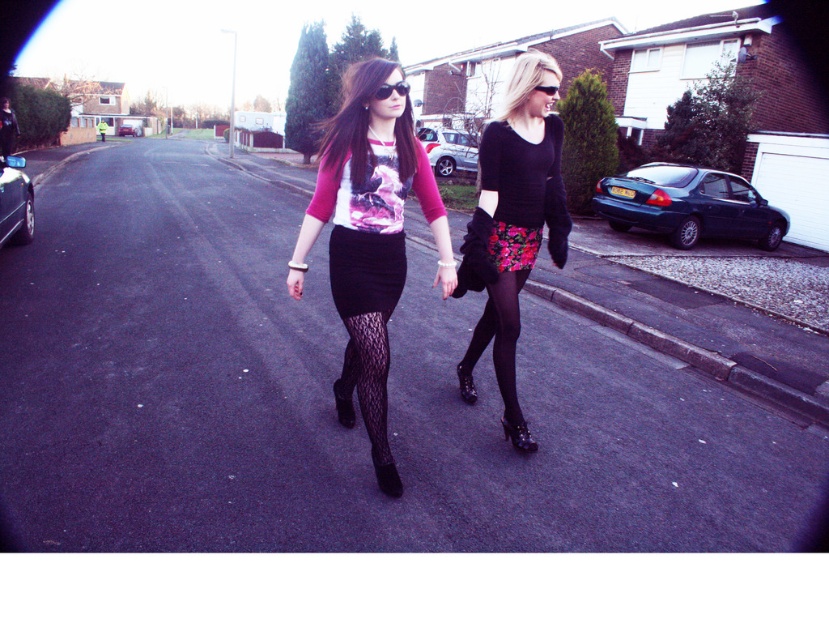
Question: Does black textured tights at center come behind black leather boot at lower center?

Choices:
 (A) no
 (B) yes

Answer: (A)

Question: Which of the following is the farthest from the observer?

Choices:
 (A) black textured tights at center
 (B) black plastic sunglasses at upper center
 (C) matte floral top at center
 (D) black lace boot at center

Answer: (D)

Question: Does black floral skirt at center lie behind black lace boot at center?

Choices:
 (A) no
 (B) yes

Answer: (A)

Question: Among these points, which one is farthest from the camera?

Choices:
 (A) (458, 371)
 (B) (362, 100)
 (C) (503, 420)
 (D) (459, 360)

Answer: (D)

Question: Among these points, which one is nearest to the camera?

Choices:
 (A) (381, 86)
 (B) (357, 260)

Answer: (A)

Question: Does shiny black boot at lower center appear over black lace boot at center?

Choices:
 (A) no
 (B) yes

Answer: (A)